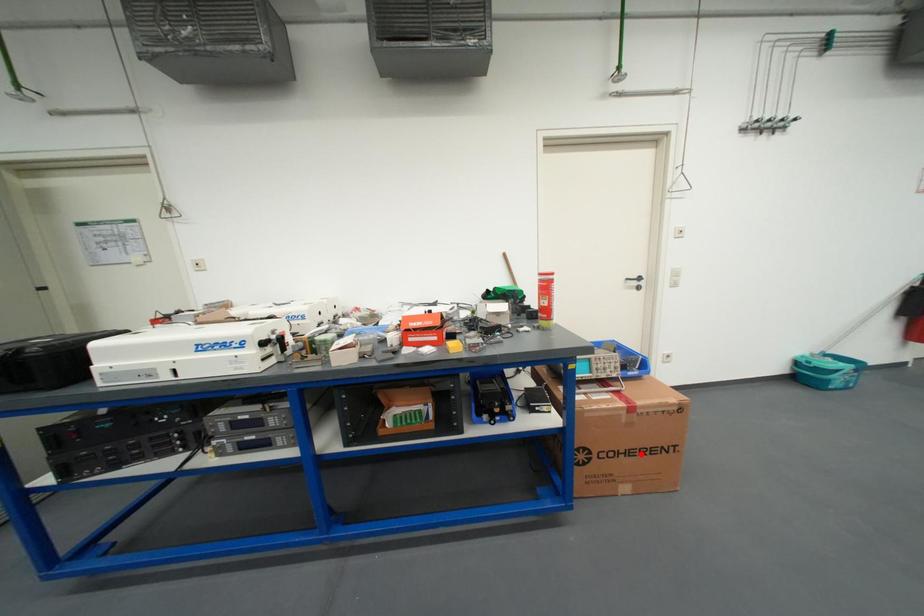
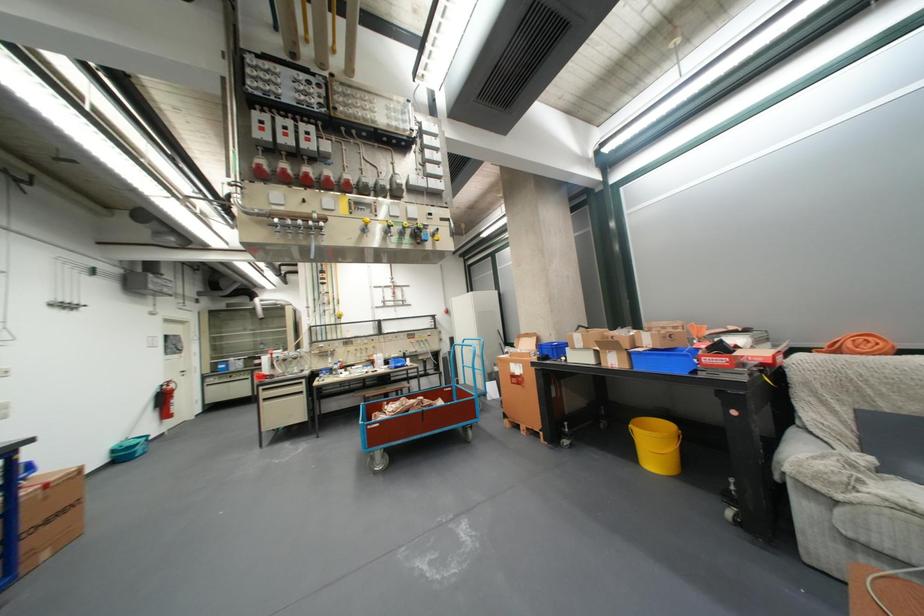
Question: A red point is marked in image1. In image2, is the corresponding 3D point closer to the camera or farther? Reply with the corresponding letter.

Choices:
 (A) The corresponding 3D point is closer.
 (B) The corresponding 3D point is farther.

Answer: (A)